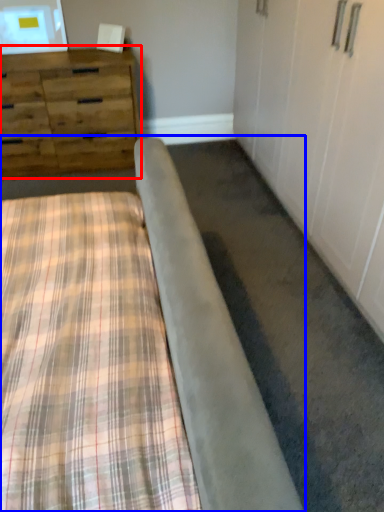
Question: Which object appears farthest to the camera in this image, chest of drawers (highlighted by a red box) or bed (highlighted by a blue box)?

Choices:
 (A) chest of drawers
 (B) bed

Answer: (A)